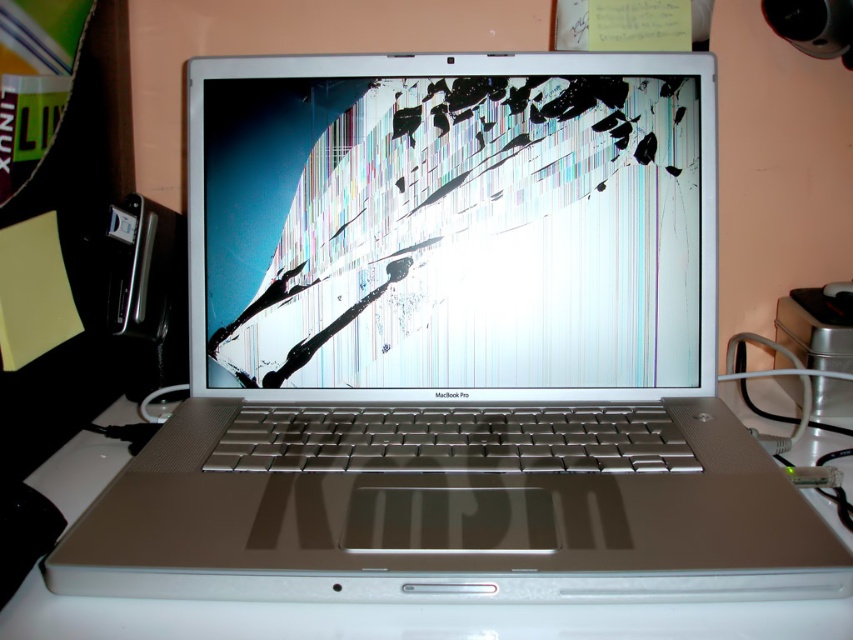
You are a repair technician assessing a damaged MacBook Pro. You need to determine the position of the cracked glass screen at center relative to the white matte table at center. Which object is positioned to the left?

The cracked glass screen at center is to the left of the white matte table at center.

You are a technician assessing the MacBook Pro laptop. You observe the cracked glass screen at center and the white matte table at center. Which object is closer to your viewpoint?

The cracked glass screen at center is closer to the viewer than the white matte table at center.